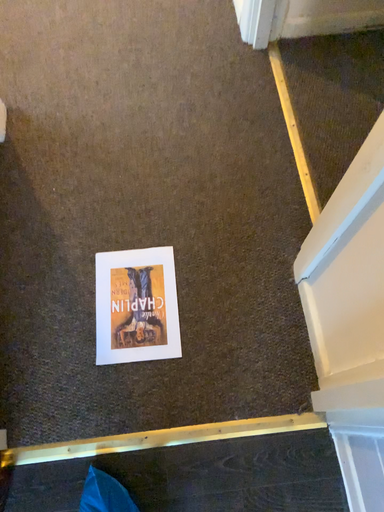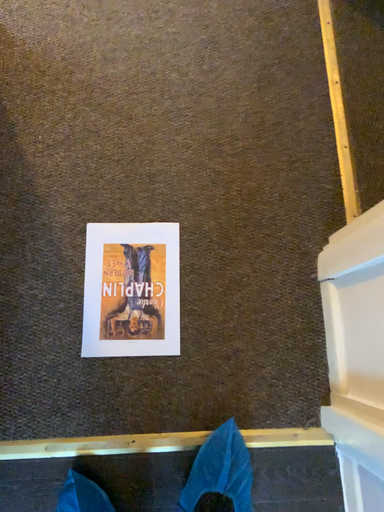
Question: Which way did the camera rotate in the video?

Choices:
 (A) rotated downward
 (B) rotated upward

Answer: (A)